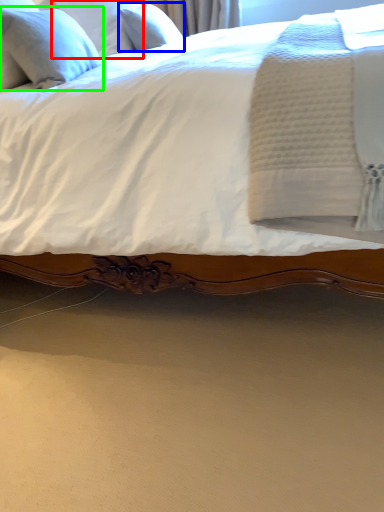
Question: Estimate the real-world distances between objects in this image. Which object is closer to pillow (highlighted by a red box), pillow (highlighted by a blue box) or pillow (highlighted by a green box)?

Choices:
 (A) pillow
 (B) pillow

Answer: (A)